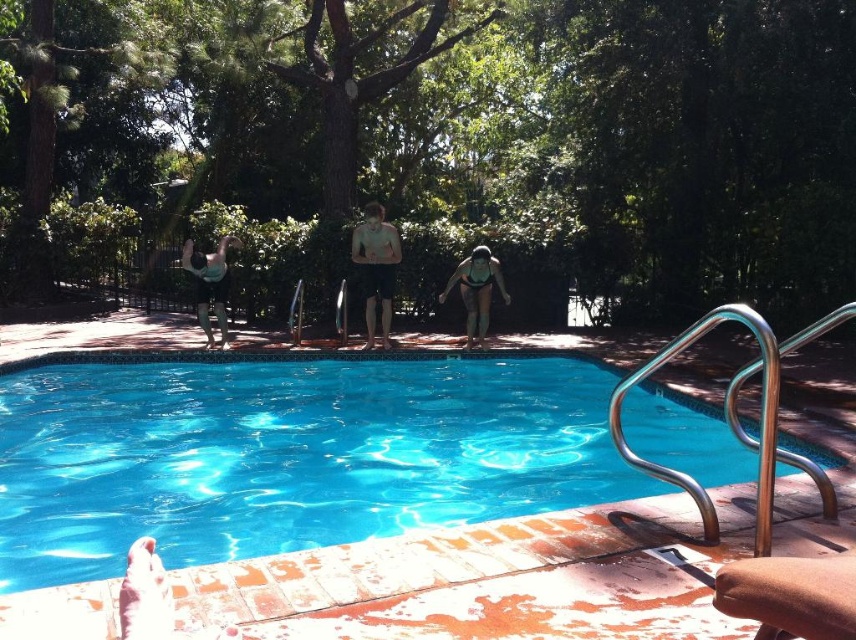
Measure the distance between blue tile pool at center and matte black swimsuit at upper left.

blue tile pool at center and matte black swimsuit at upper left are 4.73 meters apart from each other.

Which of these two, blue tile pool at center or matte black swimsuit at upper left, stands taller?

matte black swimsuit at upper left is taller.

Is point (530, 372) closer to camera compared to point (229, 346)?

That is True.

Find the location of a particular element. The width and height of the screenshot is (856, 640). blue tile pool at center is located at coordinates (286, 452).

Is blue tile pool at center above smooth skin man at center?

Actually, blue tile pool at center is below smooth skin man at center.

Does blue tile pool at center lie in front of smooth skin man at center?

Yes, blue tile pool at center is closer to the viewer.

Who is more forward, (x=497, y=468) or (x=379, y=276)?

Positioned in front is point (x=497, y=468).

Locate an element on the screen. The height and width of the screenshot is (640, 856). blue tile pool at center is located at coordinates (286, 452).

Is point (369, 291) more distant than point (195, 276)?

Yes, it is behind point (195, 276).

Does point (381, 205) come closer to viewer compared to point (207, 324)?

That is False.

Image resolution: width=856 pixels, height=640 pixels. Find the location of `smooth skin man at center`. smooth skin man at center is located at coordinates point(376,266).